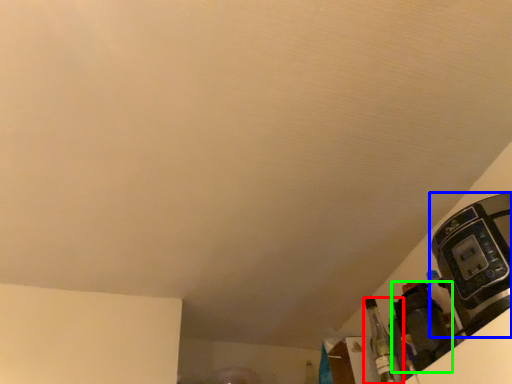
Question: Which is farther away from bottle (highlighted by a red box)? coffee machine (highlighted by a blue box) or appliance (highlighted by a green box)?

Choices:
 (A) coffee machine
 (B) appliance

Answer: (A)